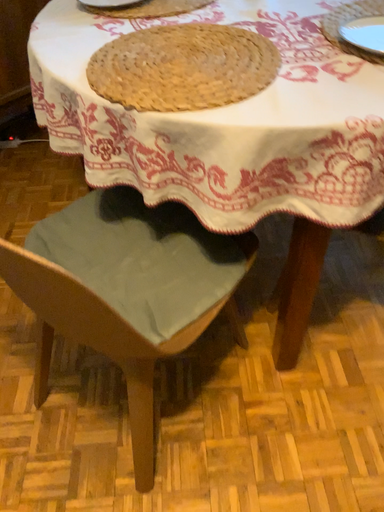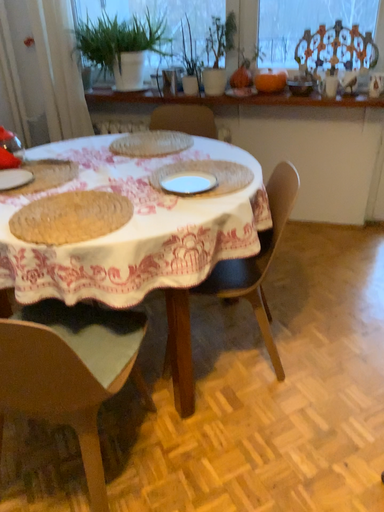
Question: How did the camera likely rotate when shooting the video?

Choices:
 (A) rotated upward
 (B) rotated downward

Answer: (A)